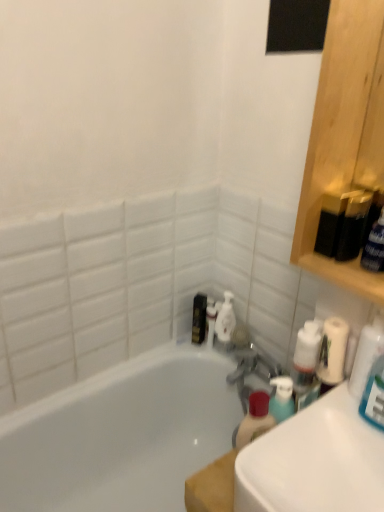
At what (x,y) coordinates should I click in order to perform the action: click on vacant space that is to the left of white plastic soap dispenser at lower center, arranged as the second toiletry when viewed from the left. Please return your answer as a coordinate pair (x, y). The height and width of the screenshot is (512, 384). Looking at the image, I should click on (181, 347).